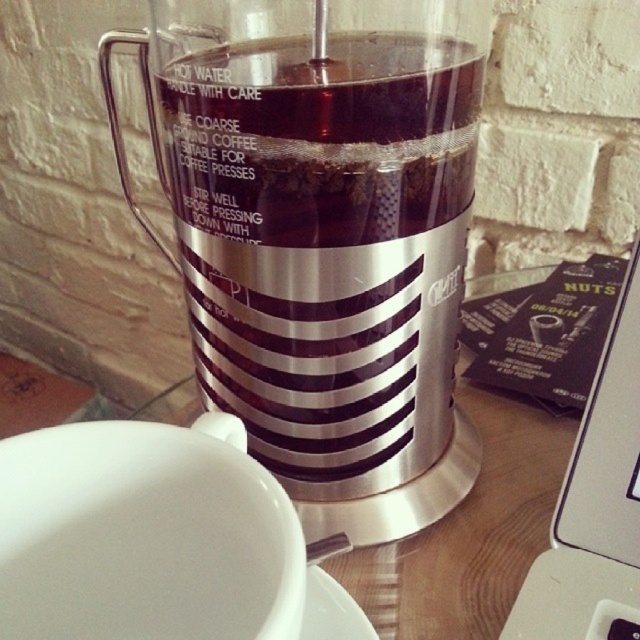
You are setting up a small kitchen counter and need to place both the satin silver blender at center and the black plastic laptop at lower right. The counter has limited space, and you must ensure they are at least 15 centimeters apart. Based on the image, will they fit with the required spacing?

The satin silver blender at center and black plastic laptop at lower right are 14.57 centimeters apart from each other, which is less than the required 15 centimeters. Therefore, they do not meet the spacing requirement and need to be rearranged to ensure proper distance.

You are setting up a workspace next to your French press coffee maker. You have a black plastic laptop at lower right and a white ceramic saucer at lower center. Which object is closer to you?

The black plastic laptop at lower right is closer to you because the white ceramic saucer at lower center is behind it.